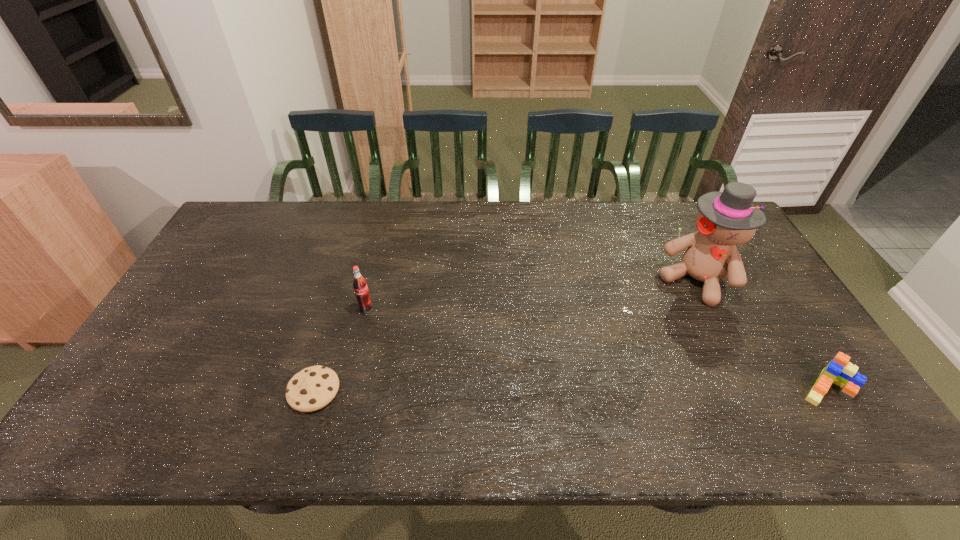
You are a GUI agent. You are given a task and a screenshot of the screen. Output one action in this format:
    pyautogui.click(x=<x>, y=<y>)
    Task: Click on the free space on the desktop that is between the cookie and the second shortest object and is positioned on the front-facing side of the rag_doll
    The image size is (960, 540).
    Given the screenshot: What is the action you would take?
    pyautogui.click(x=612, y=389)

This screenshot has width=960, height=540. I want to click on free space on the desktop that is between the cookie and the Lego and is positioned on the label of the soda bottle, so pos(528,389).